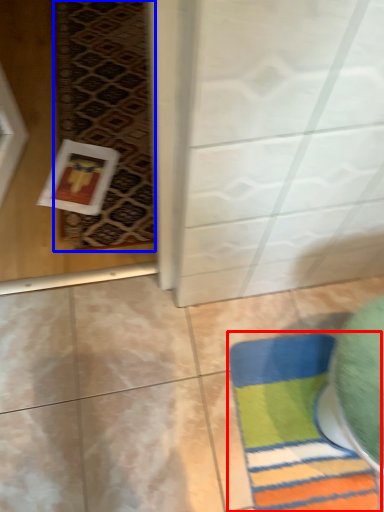
Question: Which point is closer to the camera, bath mat (highlighted by a red box) or mat (highlighted by a blue box)?

Choices:
 (A) bath mat
 (B) mat

Answer: (A)